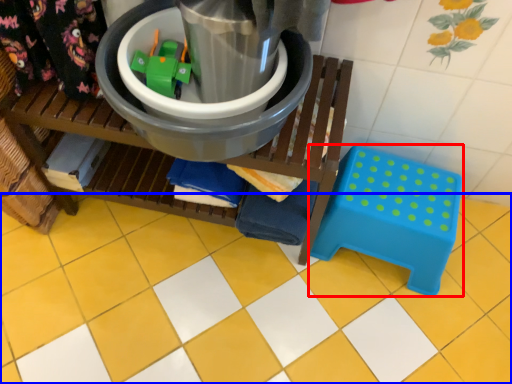
Question: Which object is closer to the camera taking this photo, step stool (highlighted by a red box) or ceramic tile (highlighted by a blue box)?

Choices:
 (A) step stool
 (B) ceramic tile

Answer: (B)